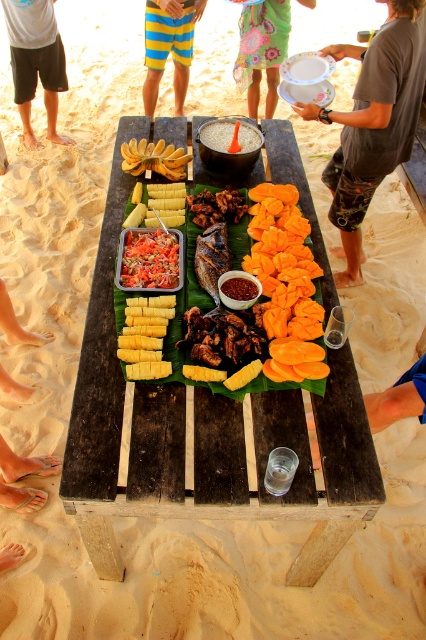
Where is the dark wood table at center located in the image?

The dark wood table at center is located at point (204, 433).